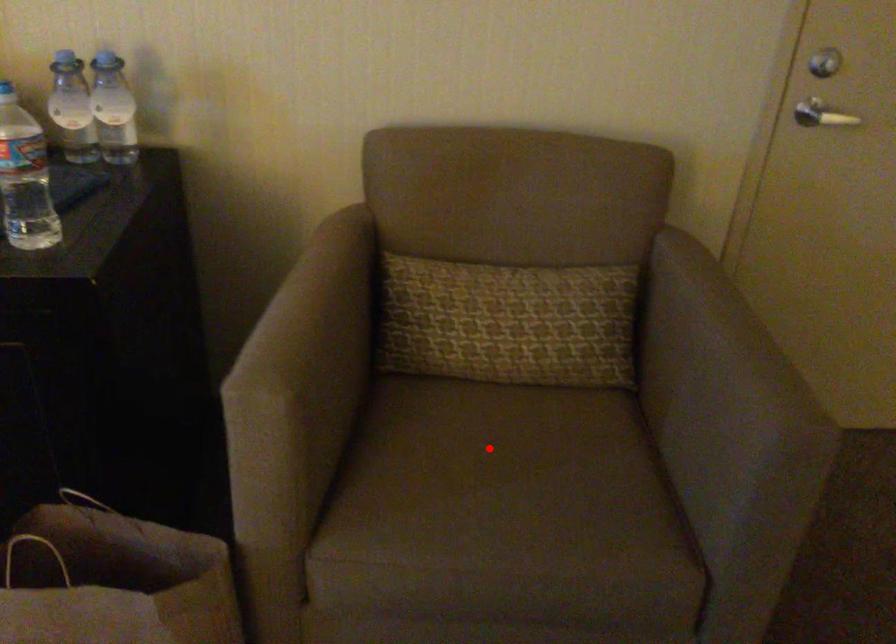
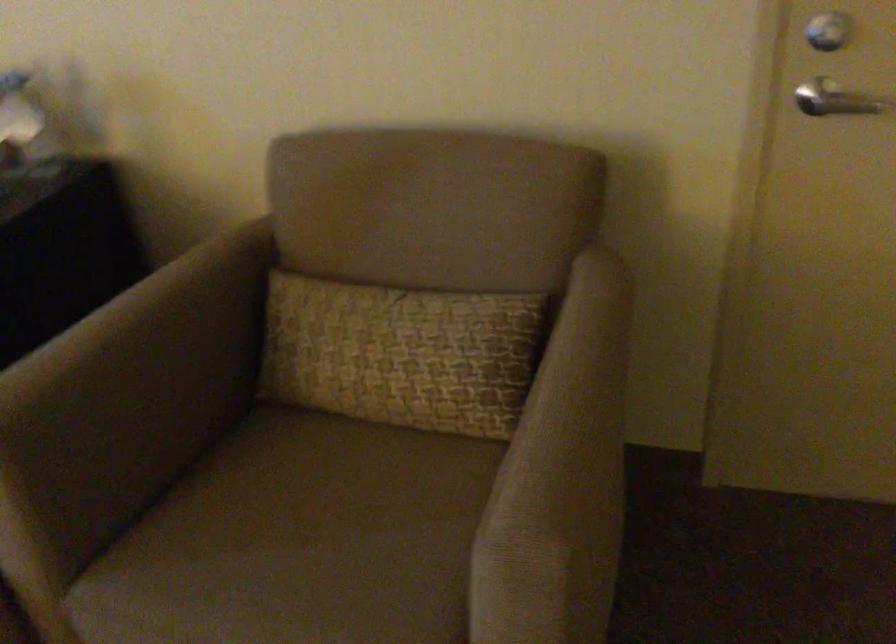
The point at the highlighted location is marked in the first image. Where is the corresponding point in the second image?

(314, 500)